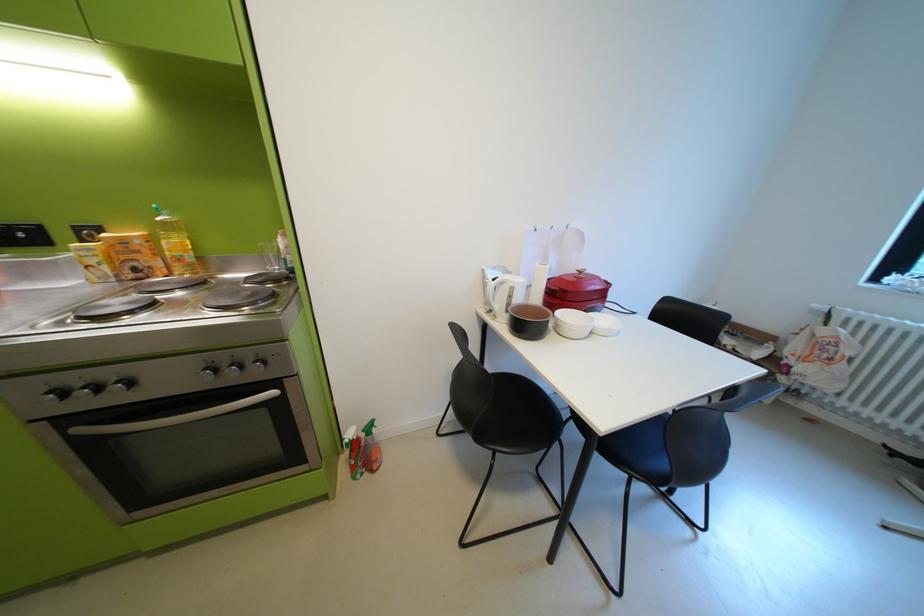
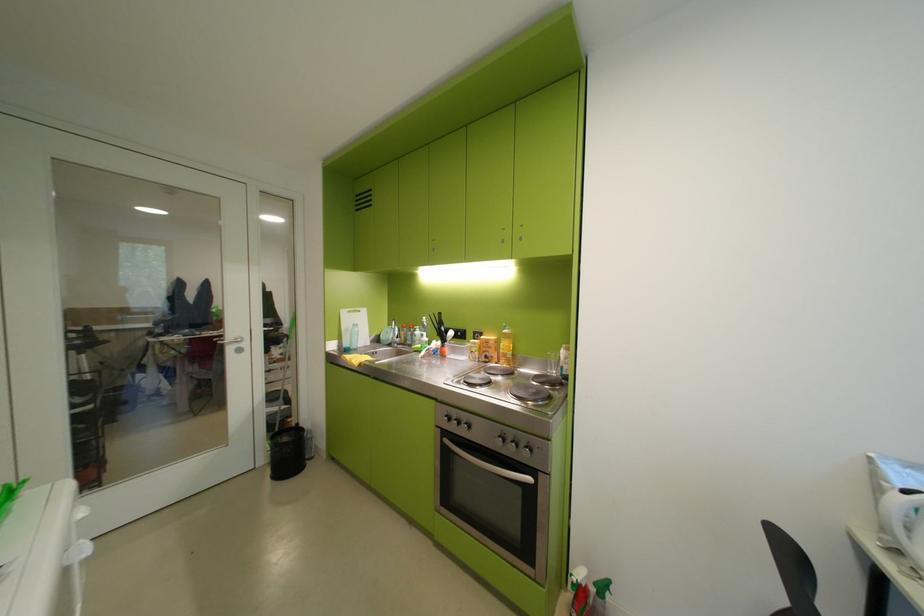
Locate, in the second image, the point that corresponds to point (226, 371) in the first image.

(515, 440)